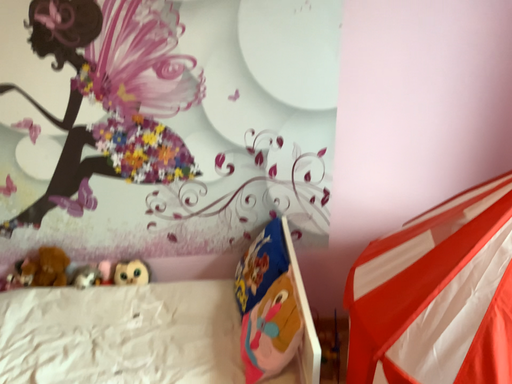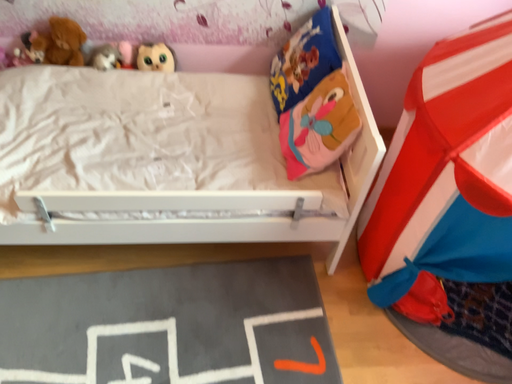
Question: How did the camera likely rotate when shooting the video?

Choices:
 (A) rotated upward
 (B) rotated downward

Answer: (B)